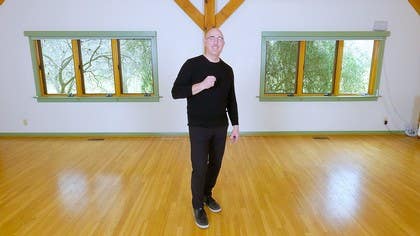
Locate an element on the screen. windows is located at coordinates (360, 61), (320, 60), (281, 59), (138, 59), (99, 60), (59, 62).